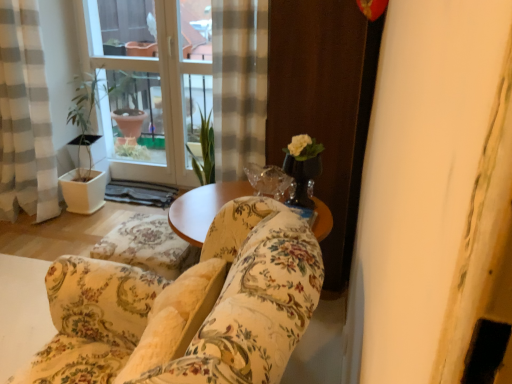
Find the location of a particular element. This screenshot has height=384, width=512. transparent glass vase at center is located at coordinates (302, 178).

The width and height of the screenshot is (512, 384). What do you see at coordinates (129, 78) in the screenshot?
I see `transparent glass window at upper left` at bounding box center [129, 78].

Locate an element on the screen. wooden screen door at right is located at coordinates (324, 106).

Where is `transparent glass vase at center`? The width and height of the screenshot is (512, 384). transparent glass vase at center is located at coordinates (302, 178).

Is transparent glass vase at center wider than transparent glass window at upper left?

No.

Is transparent glass window at upper left inside transparent glass vase at center?

That's incorrect, transparent glass window at upper left is not inside transparent glass vase at center.

Between transparent glass vase at center and transparent glass window at upper left, which one has smaller size?

With smaller size is transparent glass vase at center.

From the picture: In terms of size, does gray checkered curtain at left appear bigger or smaller than transparent glass window at upper left?

Clearly, gray checkered curtain at left is larger in size than transparent glass window at upper left.

Are gray checkered curtain at left and transparent glass window at upper left far apart?

No.

Is gray checkered curtain at left aimed at transparent glass window at upper left?

No, gray checkered curtain at left is not facing towards transparent glass window at upper left.

From a real-world perspective, is gray checkered curtain at left physically located above or below transparent glass window at upper left?

In terms of real-world spatial position, gray checkered curtain at left is below transparent glass window at upper left.

Can we say floral fabric sofa at center lies outside wooden screen door at right?

Yes, floral fabric sofa at center is not within wooden screen door at right.

Does point (138, 230) lie in front of point (313, 42)?

That is False.

In the scene shown: Is floral fabric sofa at center to the left of wooden screen door at right from the viewer's perspective?

Yes, floral fabric sofa at center is to the left of wooden screen door at right.

From the image's perspective, which is above, floral fabric sofa at center or wooden screen door at right?

wooden screen door at right appears higher in the image.

From the image's perspective, between transparent glass window at upper left and gray checkered curtain at left, which one is located above?

From the image's view, transparent glass window at upper left is above.

Consider the image. Considering the sizes of transparent glass window at upper left and gray checkered curtain at left in the image, is transparent glass window at upper left bigger or smaller than gray checkered curtain at left?

transparent glass window at upper left is smaller than gray checkered curtain at left.

How many degrees apart are the facing directions of transparent glass window at upper left and gray checkered curtain at left?

The angular difference between transparent glass window at upper left and gray checkered curtain at left is 0.202 degrees.

From a real-world perspective, is transparent glass window at upper left positioned under gray checkered curtain at left based on gravity?

Actually, transparent glass window at upper left is physically above gray checkered curtain at left in the real world.

Does transparent glass window at upper left come in front of floral fabric couch at center?

No, transparent glass window at upper left is further to the viewer.

Based on the photo, can you confirm if transparent glass window at upper left is taller than floral fabric couch at center?

Correct, transparent glass window at upper left is much taller as floral fabric couch at center.

Which object is positioned more to the right, transparent glass window at upper left or floral fabric couch at center?

floral fabric couch at center.

I want to click on window screen behind the floral fabric couch at center, so click(x=129, y=78).

From a real-world perspective, is floral fabric couch at center physically located above or below gray checkered curtain at left?

From a real-world perspective, floral fabric couch at center is physically below gray checkered curtain at left.

From the picture: Choose the correct answer: Is floral fabric couch at center inside gray checkered curtain at left or outside it?

floral fabric couch at center is not enclosed by gray checkered curtain at left.

Between point (78, 333) and point (13, 135), which one is positioned in front?

The point (78, 333) is more forward.

Looking at their sizes, would you say floral fabric couch at center is wider or thinner than gray checkered curtain at left?

floral fabric couch at center is wider than gray checkered curtain at left.

Between floral fabric sofa at center and floral fabric couch at center, which one has more height?

floral fabric couch at center is taller.

Is floral fabric sofa at center wider than floral fabric couch at center?

Incorrect, the width of floral fabric sofa at center does not surpass that of floral fabric couch at center.

Looking at this image, from a real-world perspective, which object stands above the other?

floral fabric couch at center, from a real-world perspective.

Locate an element on the screen. This screenshot has height=384, width=512. window screen that is under the transparent glass vase at center (from a real-world perspective) is located at coordinates (129, 78).

Find the location of a particular element. window screen behind the gray checkered curtain at left is located at coordinates (129, 78).

Based on their spatial positions, is wooden screen door at right or floral fabric sofa at center further from gray checkered curtain at left?

Based on the image, wooden screen door at right appears to be further to gray checkered curtain at left.

Looking at the image, which one is located further to gray checkered curtain at left, floral fabric sofa at center or transparent glass vase at center?

transparent glass vase at center.

From the image, which object appears to be nearer to transparent glass window at upper left, transparent glass vase at center or floral fabric couch at center?

transparent glass vase at center.

Estimate the real-world distances between objects in this image. Which object is further from gray checkered curtain at left, transparent glass window at upper left or floral fabric couch at center?

floral fabric couch at center lies further to gray checkered curtain at left than the other object.

Based on their spatial positions, is floral fabric couch at center or transparent glass window at upper left closer to wooden screen door at right?

floral fabric couch at center lies closer to wooden screen door at right than the other object.

Considering their positions, is wooden screen door at right positioned closer to floral fabric sofa at center than transparent glass vase at center?

transparent glass vase at center lies closer to floral fabric sofa at center than the other object.

From the image, which object appears to be nearer to transparent glass vase at center, transparent glass window at upper left or wooden screen door at right?

The object closer to transparent glass vase at center is wooden screen door at right.

Looking at the image, which one is located closer to transparent glass window at upper left, wooden screen door at right or gray checkered curtain at left?

Based on the image, gray checkered curtain at left appears to be nearer to transparent glass window at upper left.

Find the location of a particular element. The image size is (512, 384). glass vase between floral fabric couch at center and gray checkered curtain at left in the front-back direction is located at coordinates tap(302, 178).

Identify the location of window screen between gray checkered curtain at left and transparent glass vase at center in the horizontal direction. (129, 78).

What are the coordinates of `glass vase positioned between floral fabric couch at center and wooden screen door at right from near to far` in the screenshot? It's located at (302, 178).

Identify the location of studio couch located between gray checkered curtain at left and wooden screen door at right in the left-right direction. This screenshot has width=512, height=384. (189, 305).